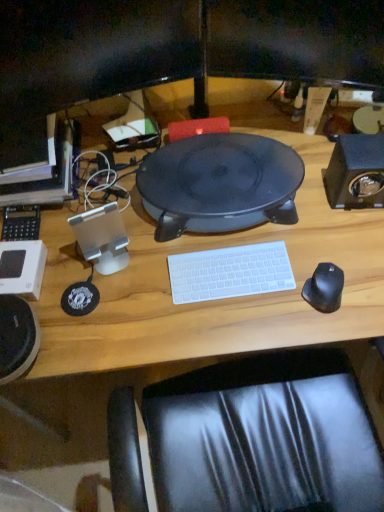
Locate an element on the screen. free area in between white plastic keyboard at center and black matte speaker at center is located at coordinates (228, 251).